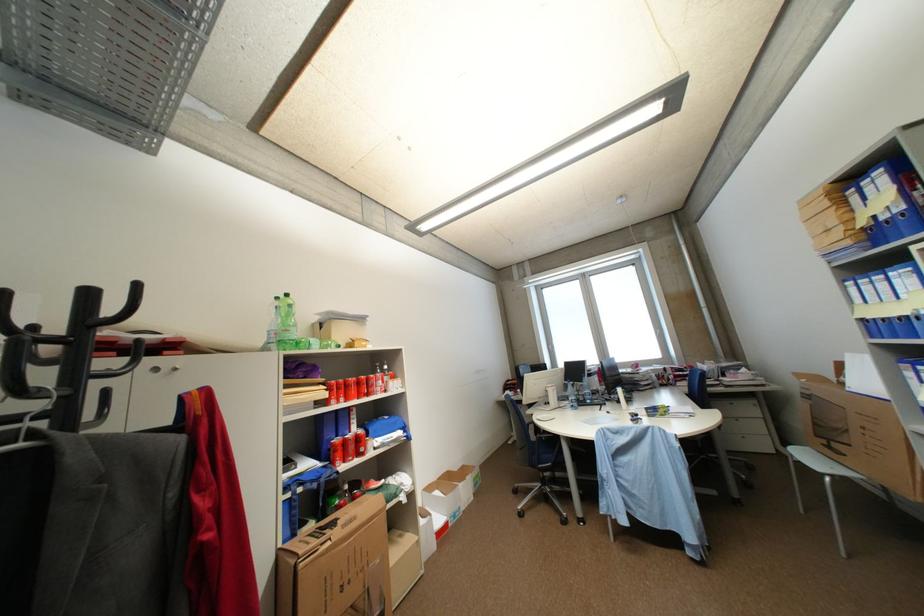
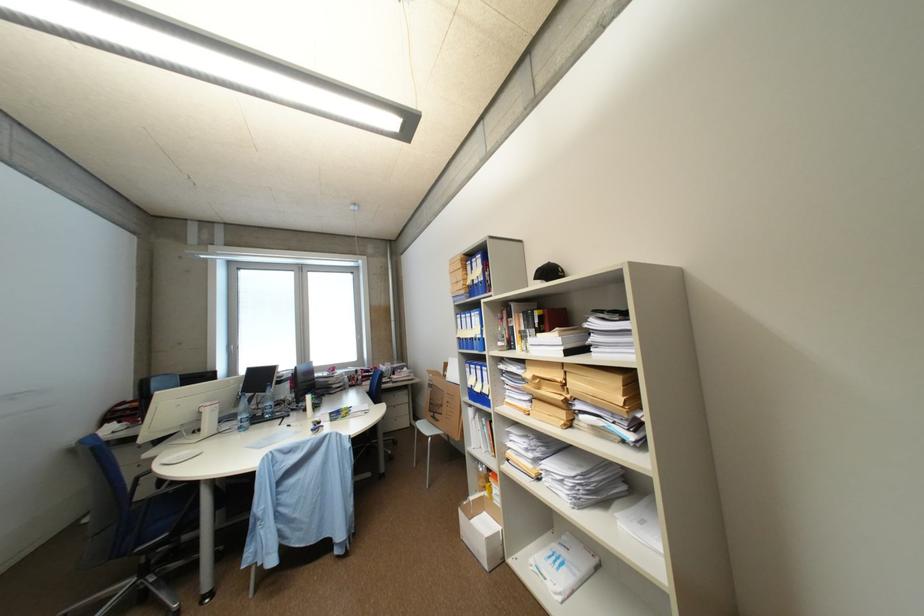
Question: The camera is either moving clockwise (left) or counter-clockwise (right) around the object. The first image is from the beginning of the video and the second image is from the end. Is the camera moving left or right when shooting the video?

Choices:
 (A) Left
 (B) Right

Answer: (A)